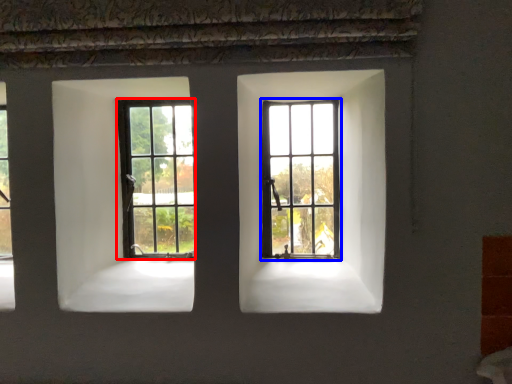
Question: Which of the following is the closest to the observer, window (highlighted by a red box) or window (highlighted by a blue box)?

Choices:
 (A) window
 (B) window

Answer: (B)